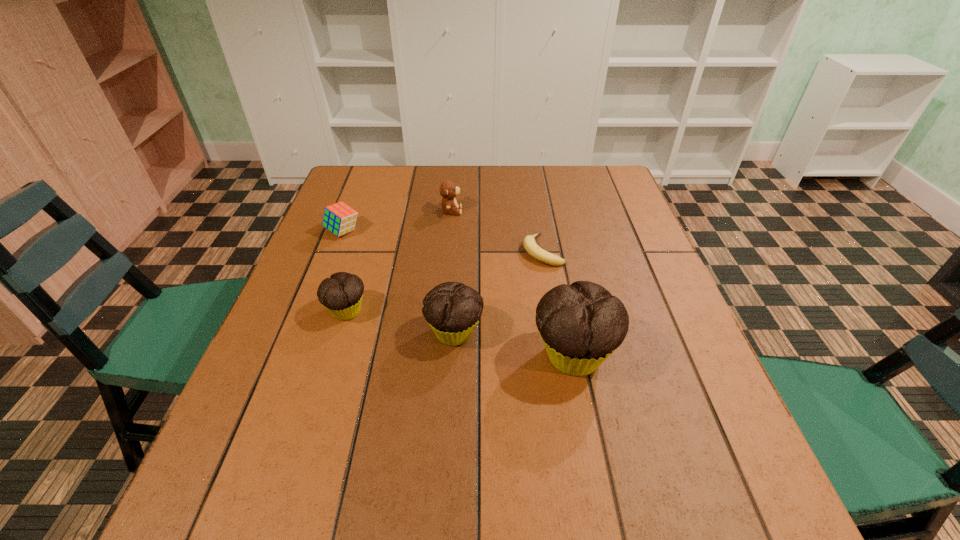
The image size is (960, 540). In order to click on free spot between the rightmost muffin and the teddy bear in this screenshot , I will do pyautogui.click(x=513, y=284).

Locate an element on the screen. The image size is (960, 540). unoccupied position between the farthest object and the second shortest muffin is located at coordinates (453, 272).

Where is `the third closest object to the shortest muffin`? The height and width of the screenshot is (540, 960). the third closest object to the shortest muffin is located at coordinates (448, 190).

Identify which object is the second nearest to the fifth shortest object. Please provide its 2D coordinates. Your answer should be formatted as a tuple, i.e. [(x, y)], where the tuple contains the x and y coordinates of a point satisfying the conditions above.

[(342, 293)]

Image resolution: width=960 pixels, height=540 pixels. I want to click on the second closest muffin to the second tallest muffin, so click(342, 293).

Locate which muffin ranks in proximity to the farthest object. Please provide its 2D coordinates. Your answer should be formatted as a tuple, i.e. [(x, y)], where the tuple contains the x and y coordinates of a point satisfying the conditions above.

[(342, 293)]

The height and width of the screenshot is (540, 960). In order to click on vacant region that satisfies the following two spatial constraints: 1. on the front side of the second muffin from right to left; 2. on the right side of the tallest muffin in this screenshot , I will do `click(453, 356)`.

Where is `vacant position in the image that satisfies the following two spatial constraints: 1. on the face of the teddy bear; 2. on the back side of the second muffin from left to right`? The image size is (960, 540). vacant position in the image that satisfies the following two spatial constraints: 1. on the face of the teddy bear; 2. on the back side of the second muffin from left to right is located at coordinates (442, 333).

Find the location of a particular element. The height and width of the screenshot is (540, 960). free spot that satisfies the following two spatial constraints: 1. on the face of the teddy bear; 2. on the back side of the second tallest object is located at coordinates (442, 333).

Identify the location of free region that satisfies the following two spatial constraints: 1. on the front side of the cube; 2. on the left side of the rightmost muffin. The width and height of the screenshot is (960, 540). (295, 356).